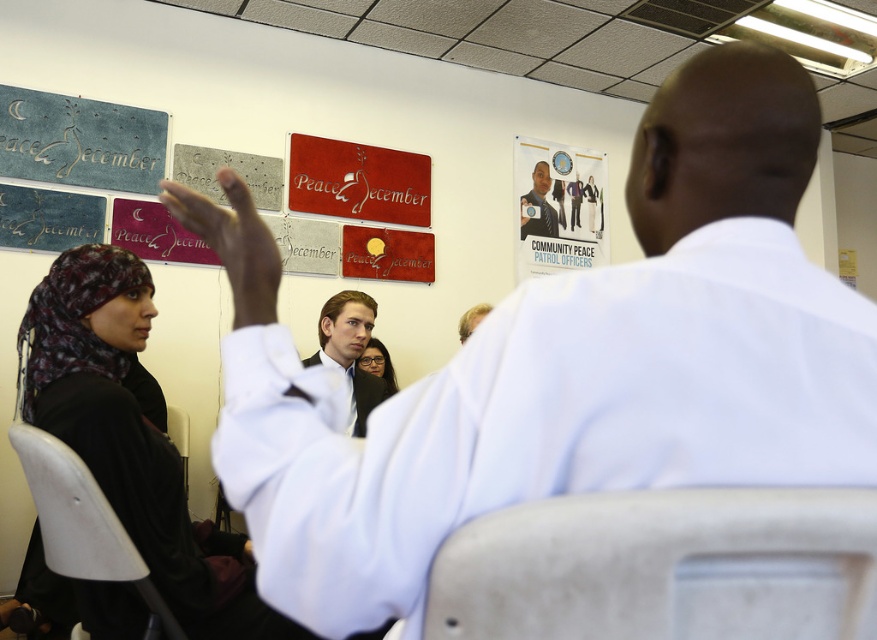
Question: Can you confirm if white glossy poster at upper center is smaller than dark blue uniform at upper center?

Choices:
 (A) no
 (B) yes

Answer: (A)

Question: Can you confirm if matte black hand at upper center is positioned above light brown shirt at center?

Choices:
 (A) yes
 (B) no

Answer: (A)

Question: Observing the image, what is the correct spatial positioning of matte black hand at upper center in reference to dark blue uniform at upper center?

Choices:
 (A) above
 (B) below

Answer: (B)

Question: Which object appears farthest from the camera in this image?

Choices:
 (A) light brown shirt at center
 (B) matte black hand at upper center

Answer: (A)

Question: Which of the following is the farthest from the observer?

Choices:
 (A) white glossy poster at upper center
 (B) light brown hair at center
 (C) matte black hand at upper center
 (D) light brown shirt at center

Answer: (A)

Question: Which of the following is the farthest from the observer?

Choices:
 (A) (258, 312)
 (B) (481, 310)
 (C) (555, 212)

Answer: (C)